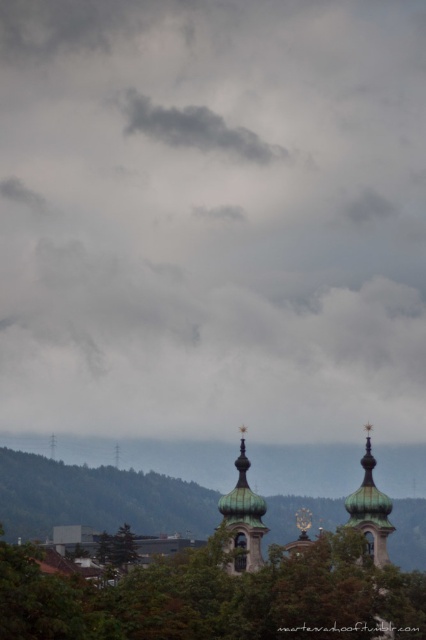
Question: Estimate the real-world distances between objects in this image. Which object is farther from the copper dome at center?

Choices:
 (A) green copper dome at center
 (B) cloudy gray sky at upper center

Answer: (B)

Question: Among these points, which one is nearest to the camera?

Choices:
 (A) (273, 182)
 (B) (259, 508)

Answer: (B)

Question: Which object is the farthest from the dark gray cloud at upper center?

Choices:
 (A) cloudy gray sky at upper center
 (B) green copper dome at center
 (C) green leafy tree at lower center
 (D) copper dome at center

Answer: (C)

Question: Is cloudy gray sky at upper center to the right of green leafy tree at lower center from the viewer's perspective?

Choices:
 (A) yes
 (B) no

Answer: (B)

Question: Is the position of cloudy gray sky at upper center less distant than that of green copper dome at center?

Choices:
 (A) no
 (B) yes

Answer: (A)

Question: Observing the image, what is the correct spatial positioning of cloudy gray sky at upper center in reference to green leafy tree at lower center?

Choices:
 (A) left
 (B) right

Answer: (A)